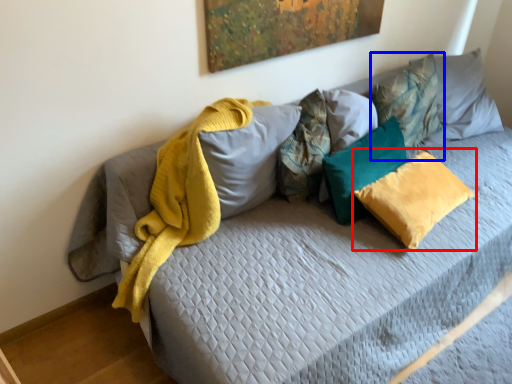
Question: Which point is further to the camera, pillow (highlighted by a red box) or pillow (highlighted by a blue box)?

Choices:
 (A) pillow
 (B) pillow

Answer: (B)